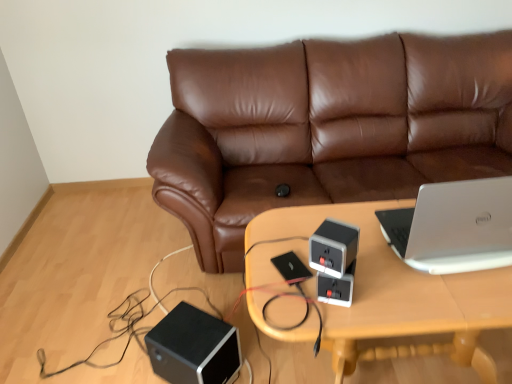
Question: Do you think black matte speaker at lower left, marked as the second speaker in a top-to-bottom arrangement, is within brown leather couch at center, or outside of it?

Choices:
 (A) outside
 (B) inside

Answer: (A)

Question: Considering the positions of point (210, 317) and point (375, 195), is point (210, 317) closer or farther from the camera than point (375, 195)?

Choices:
 (A) closer
 (B) farther

Answer: (A)

Question: Estimate the real-world distances between objects in this image. Which object is closer to the gray matte speaker at center, which is the 2th speaker in left-to-right order?

Choices:
 (A) silver metallic laptop at right
 (B) black matte speaker at lower left, marked as the second speaker in a top-to-bottom arrangement
 (C) brown leather couch at center
 (D) wooden table at center

Answer: (D)

Question: Which object is the closest to the gray matte speaker at center, which is the 2th speaker in left-to-right order?

Choices:
 (A) brown leather couch at center
 (B) black matte speaker at lower left, which ranks as the first speaker in bottom-to-top order
 (C) wooden table at center
 (D) silver metallic laptop at right

Answer: (C)